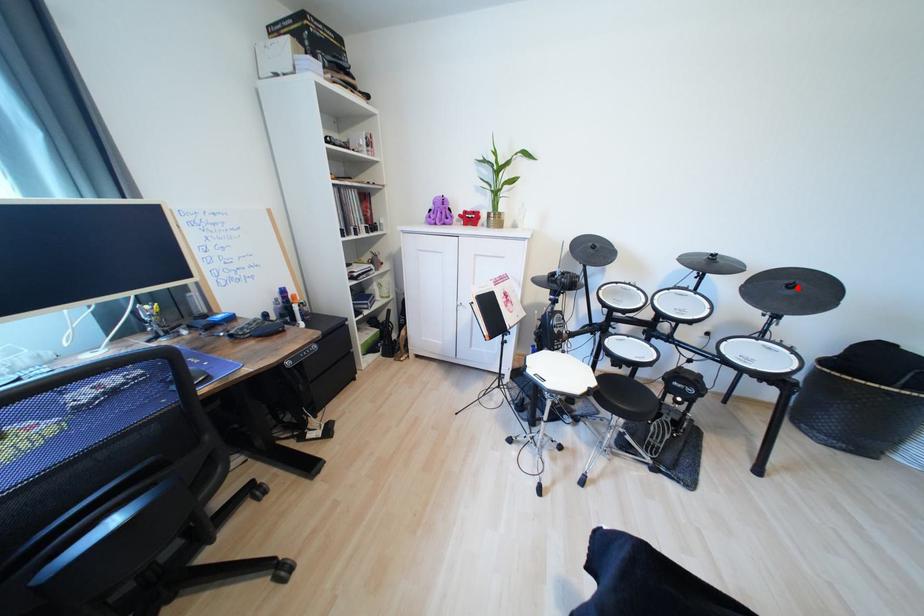
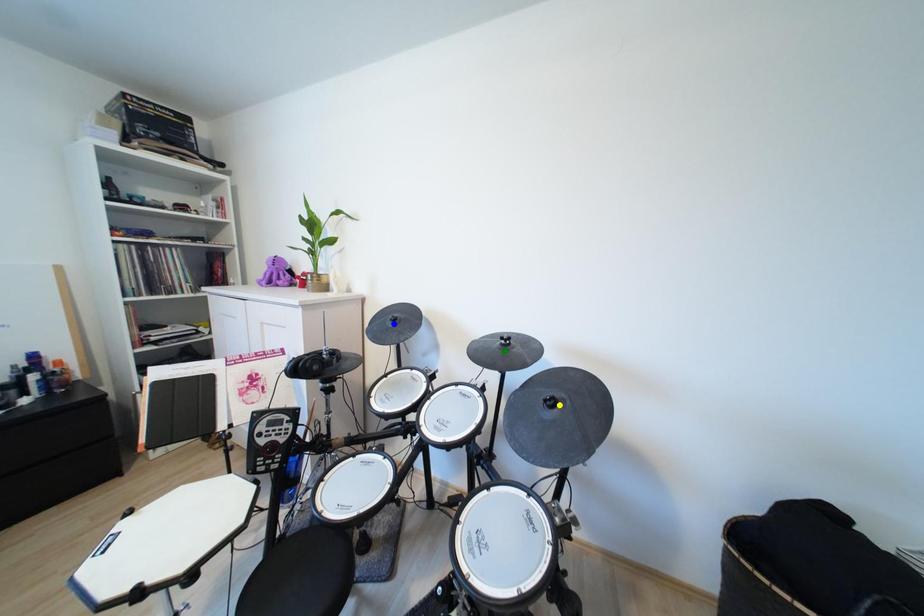
Question: I am providing you with two images of the same scene from different viewpoints. A red point is marked on the first image. You are given multiple points on the second image. Can you choose the point in image 2 that corresponds to the point in image 1?

Choices:
 (A) blue point
 (B) green point
 (C) yellow point

Answer: (C)